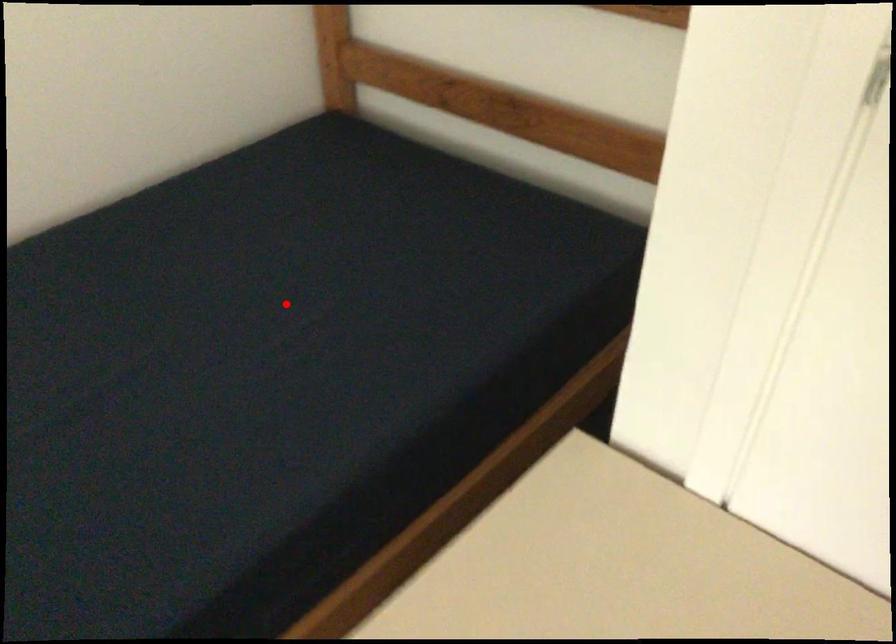
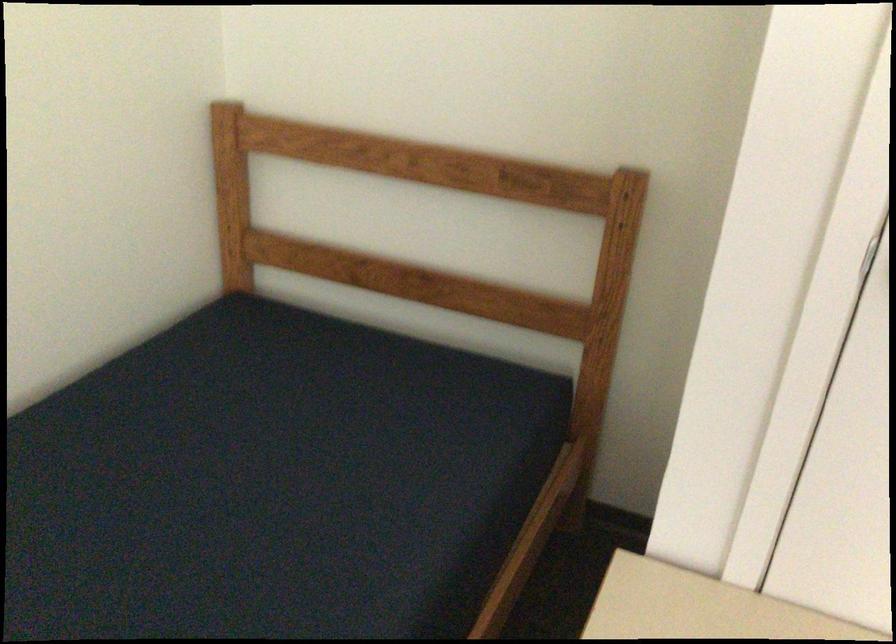
Locate, in the second image, the point that corresponds to the highlighted location in the first image.

(273, 484)